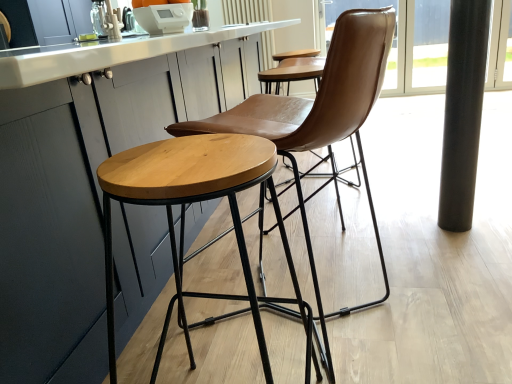
This screenshot has height=384, width=512. Find the location of `vacant space to the left of brown leather chair at center`. vacant space to the left of brown leather chair at center is located at coordinates tap(183, 316).